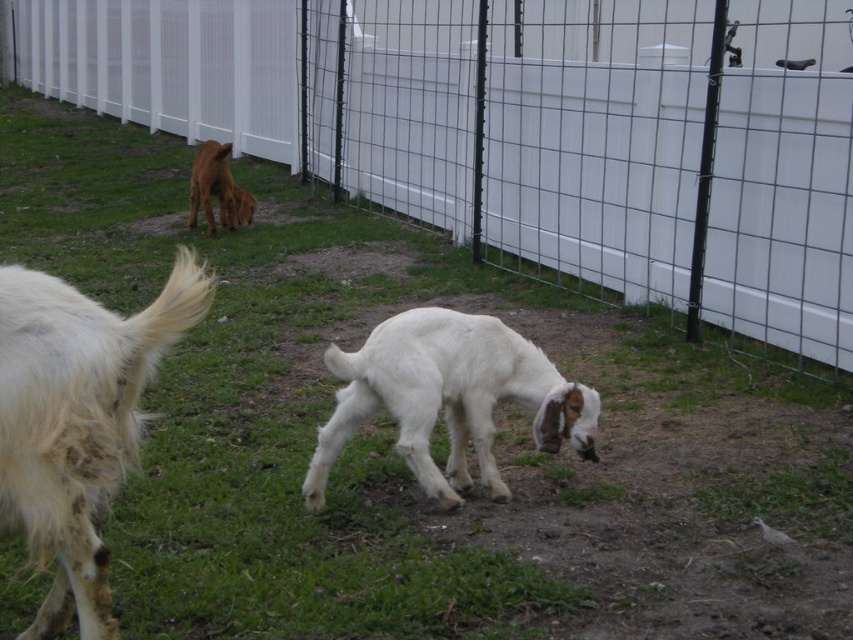
You are standing at the center of the fenced area and want to reach the white goat with a fluffy coat and brown markings on its legs and face that is eating grass near the center of the frame. Which direction should you move to avoid the white wire fence at center located at point [521,131]?

Since the white wire fence at center is located at point [521,131], you should move towards the direction away from that point to avoid it while heading towards the white goat. The exact direction depends on your current position, but generally, moving perpendicular to the fence line would be safest.

You are a farmer checking the animals in your fenced area. You need to know which animal is taller between the white woolen goat at center and the brown fur dog at upper left. Based on the scene, which one is taller?

The brown fur dog at upper left is taller than the white woolen goat at center.

You are standing in the fenced outdoor area and want to place a small sign at the point closer to you between the two points marked as point (538,413) and point (224,182). Which point should you choose?

You should choose point (538,413) because it is closer to the camera than point (224,182).